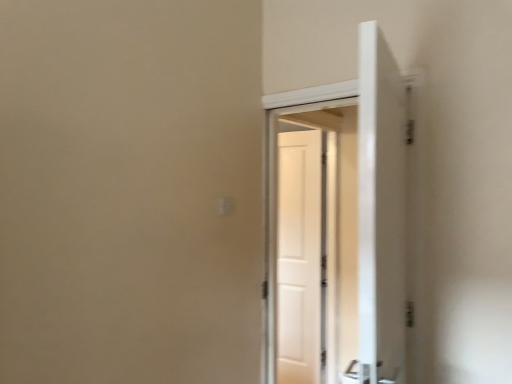
Measure the distance between point (x=307, y=235) and camera.

Point (x=307, y=235) and camera are 10.78 feet apart from each other.

Describe the element at coordinates (298, 257) in the screenshot. I see `white matte door at center` at that location.

Find the location of `white matte door at center`. white matte door at center is located at coordinates (298, 257).

In order to face white glossy door at center, should I rotate leftwards or rightwards?

Rotate right and turn 6.648 degrees.

Where is `white glossy door at center`? The image size is (512, 384). white glossy door at center is located at coordinates (313, 242).

What do you see at coordinates (313, 242) in the screenshot? I see `white glossy door at center` at bounding box center [313, 242].

The image size is (512, 384). Find the location of `white matte door at center`. white matte door at center is located at coordinates (298, 257).

Based on their positions, is white glossy door at center located to the left or right of white matte door at center?

In the image, white glossy door at center appears on the left side of white matte door at center.

Considering their positions, is white glossy door at center located in front of or behind white matte door at center?

white glossy door at center is in front of white matte door at center.

Which is in front, point (268, 236) or point (291, 255)?

The point (268, 236) is in front.

From the image's perspective, is white glossy door at center below white matte door at center?

No.

From a real-world perspective, is white glossy door at center located beneath white matte door at center?

No, from a real-world perspective, white glossy door at center is not below white matte door at center.

Considering the sizes of objects white glossy door at center and white matte door at center in the image provided, who is thinner, white glossy door at center or white matte door at center?

white matte door at center is thinner.

Considering the sizes of objects white glossy door at center and white matte door at center in the image provided, who is shorter, white glossy door at center or white matte door at center?

white matte door at center.

Which of these two, white glossy door at center or white matte door at center, is bigger?

white glossy door at center is bigger.

Is white matte door at center inside white glossy door at center?

No, white matte door at center is not surrounded by white glossy door at center.

Is white glossy door at center directly adjacent to white matte door at center?

Yes, white glossy door at center is right next to white matte door at center and making contact.

Is white glossy door at center oriented towards white matte door at center?

Yes.

How many degrees apart are the facing directions of white glossy door at center and white matte door at center?

There is a 80-degree angle between the facing directions of white glossy door at center and white matte door at center.

Measure the distance between white glossy door at center and white matte door at center.

2.75 inches.

Identify the location of door located underneath the white glossy door at center (from a real-world perspective). Image resolution: width=512 pixels, height=384 pixels. (298, 257).

Can you confirm if white matte door at center is positioned to the left of white glossy door at center?

No, white matte door at center is not to the left of white glossy door at center.

Relative to white glossy door at center, is white matte door at center in front or behind?

In the image, white matte door at center appears behind white glossy door at center.

Considering the positions of points (286, 241) and (355, 283), is point (286, 241) farther from camera compared to point (355, 283)?

Yes, it is behind point (355, 283).

From the picture: From the image's perspective, which object appears higher, white matte door at center or white glossy door at center?

From the image's view, white glossy door at center is above.

From a real-world perspective, between white matte door at center and white glossy door at center, who is vertically higher?

white glossy door at center is physically above.

Does white matte door at center have a lesser width compared to white glossy door at center?

Indeed, white matte door at center has a lesser width compared to white glossy door at center.

Which of these two, white matte door at center or white glossy door at center, stands taller?

white glossy door at center.

Is white matte door at center bigger or smaller than white glossy door at center?

In the image, white matte door at center appears to be smaller than white glossy door at center.

Is white matte door at center inside the boundaries of white glossy door at center, or outside?

white matte door at center is located beyond the bounds of white glossy door at center.

Can you see white matte door at center touching white glossy door at center?

Yes, white matte door at center and white glossy door at center clearly make contact.

Is white matte door at center facing towards white glossy door at center?

Yes, white matte door at center faces towards white glossy door at center.

Can you tell me how much white matte door at center and white glossy door at center differ in facing direction?

The angular difference between white matte door at center and white glossy door at center is 80 degrees.

How distant is white matte door at center from white glossy door at center?

The distance of white matte door at center from white glossy door at center is 7.00 centimeters.

You are a GUI agent. You are given a task and a screenshot of the screen. Output one action in this format:
    pyautogui.click(x=<x>, y=<y>)
    Task: Click on the door below the white glossy door at center (from the image's perspective)
    This screenshot has height=384, width=512.
    Given the screenshot: What is the action you would take?
    pyautogui.click(x=298, y=257)

At what (x,y) coordinates should I click in order to perform the action: click on door on the right of the white glossy door at center. Please return your answer as a coordinate pair (x, y). Looking at the image, I should click on (298, 257).

Locate an element on the screen. Image resolution: width=512 pixels, height=384 pixels. screen door in front of the white matte door at center is located at coordinates (313, 242).